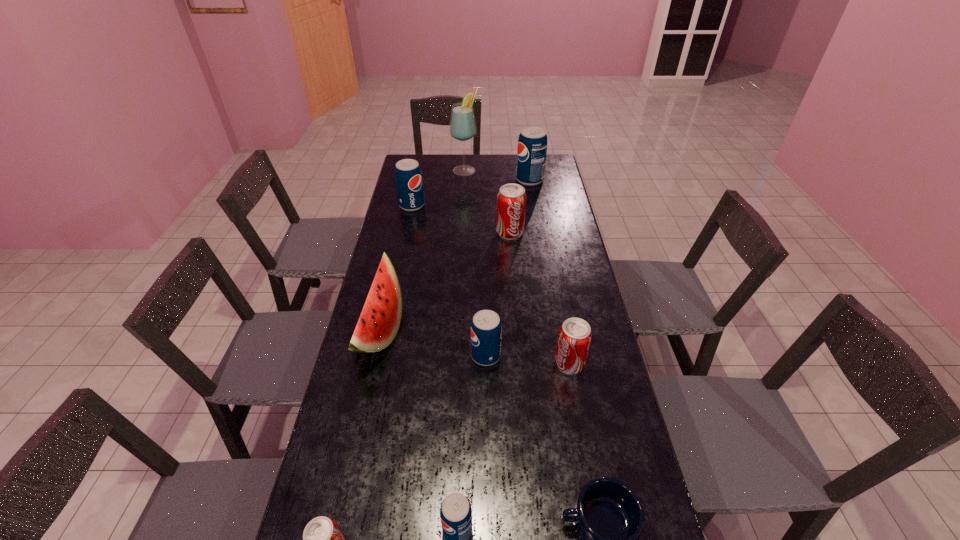
This screenshot has height=540, width=960. Find the location of `pop that is at the left edge`. pop that is at the left edge is located at coordinates (408, 176).

You are a GUI agent. You are given a task and a screenshot of the screen. Output one action in this format:
    pyautogui.click(x=<x>, y=<y>)
    Task: Click on the watermelon positioned at the left edge
    This screenshot has height=540, width=960.
    Given the screenshot: What is the action you would take?
    pyautogui.click(x=378, y=324)

Where is `object that is at the far right corner`? object that is at the far right corner is located at coordinates (532, 144).

You are a GUI agent. You are given a task and a screenshot of the screen. Output one action in this format:
    pyautogui.click(x=<x>, y=<y>)
    Task: Click on the blank space at the left edge
    The height and width of the screenshot is (540, 960).
    Given the screenshot: What is the action you would take?
    pyautogui.click(x=383, y=480)

Where is `free region at the right edge of the desktop`? free region at the right edge of the desktop is located at coordinates (551, 279).

Identify the location of free space between the third farthest blue pop and the farthest blue pop. The image size is (960, 540). (508, 268).

The height and width of the screenshot is (540, 960). Find the location of `vacant area that lies between the third farthest blue pop and the alcohol`. vacant area that lies between the third farthest blue pop and the alcohol is located at coordinates (475, 262).

You are a GUI agent. You are given a task and a screenshot of the screen. Output one action in this format:
    pyautogui.click(x=<x>, y=<y>)
    Task: Click on the free spot between the third farthest pop and the second nearest blue pop
    
    Given the screenshot: What is the action you would take?
    pyautogui.click(x=498, y=294)

Select which object appears as the ninth closest to the leftmost blue pop. Please provide its 2D coordinates. Your answer should be formatted as a tuple, i.e. [(x, y)], where the tuple contains the x and y coordinates of a point satisfying the conditions above.

[(322, 539)]

Point out which object is positioned as the seventh nearest to the smallest red soda can. Please provide its 2D coordinates. Your answer should be formatted as a tuple, i.e. [(x, y)], where the tuple contains the x and y coordinates of a point satisfying the conditions above.

[(408, 176)]